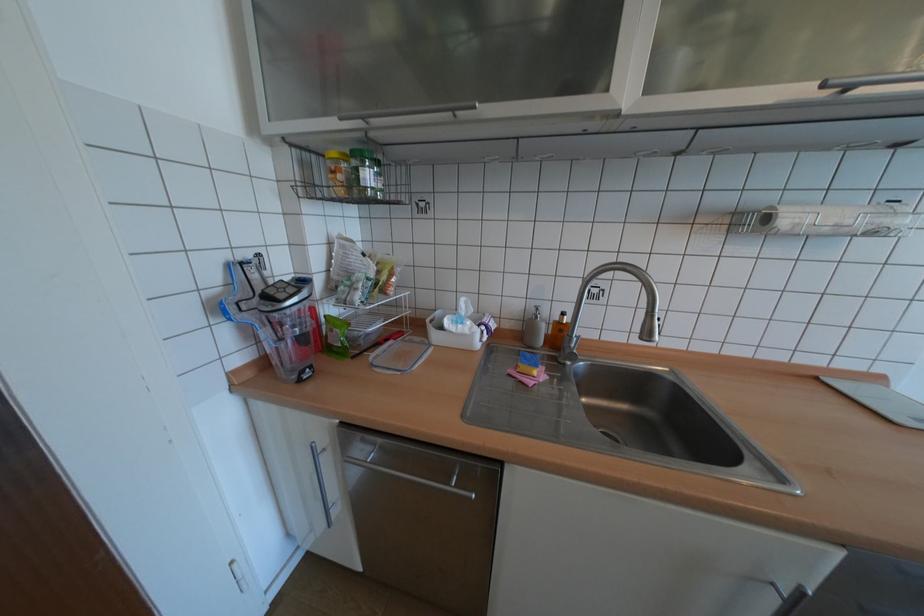
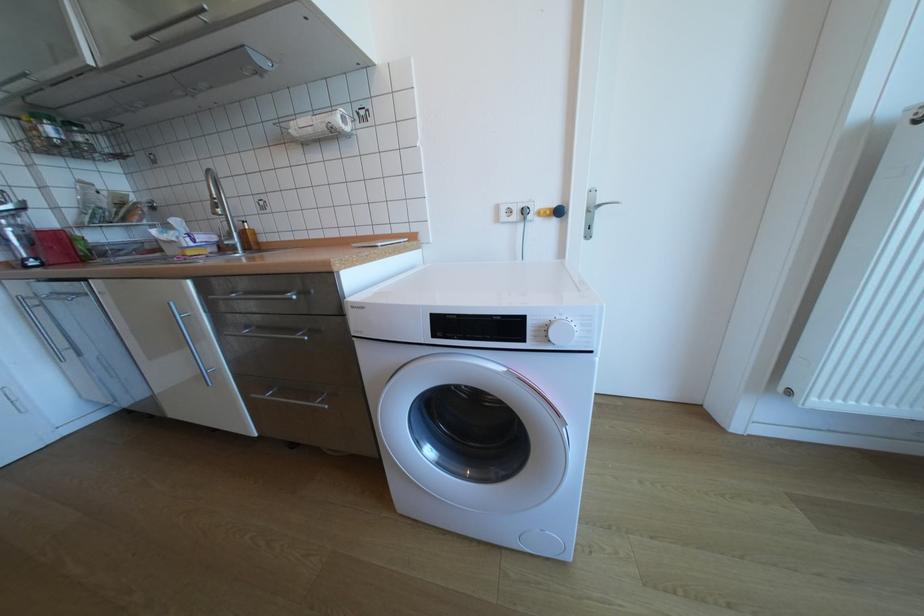
Question: What movement of the cameraman would produce the second image?

Choices:
 (A) Left
 (B) Right
 (C) Forward
 (D) Backward

Answer: (B)